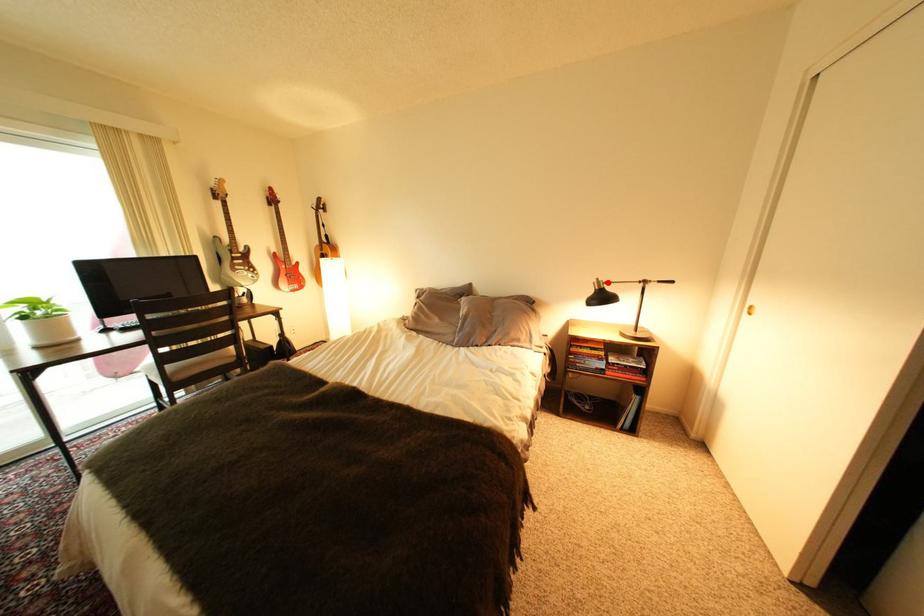
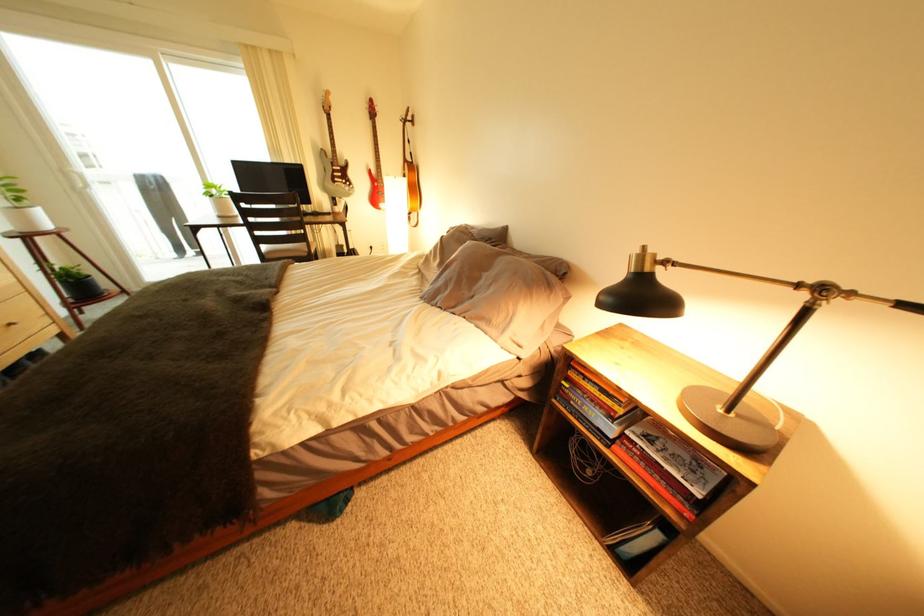
Question: I am providing you with two images of the same scene from different viewpoints. A red point is marked on the first image. Is the red point's position out of view in image 2?

Choices:
 (A) Yes
 (B) No

Answer: (B)